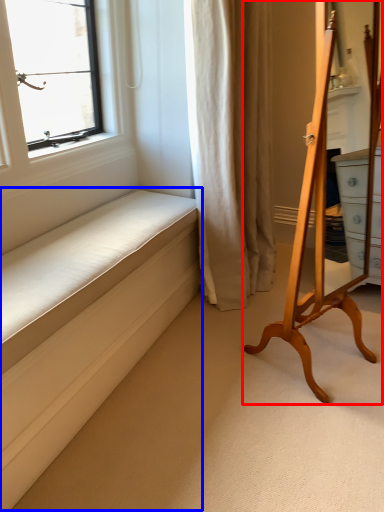
Question: Which object is closer to the camera taking this photo, furniture (highlighted by a red box) or bed frame (highlighted by a blue box)?

Choices:
 (A) furniture
 (B) bed frame

Answer: (B)